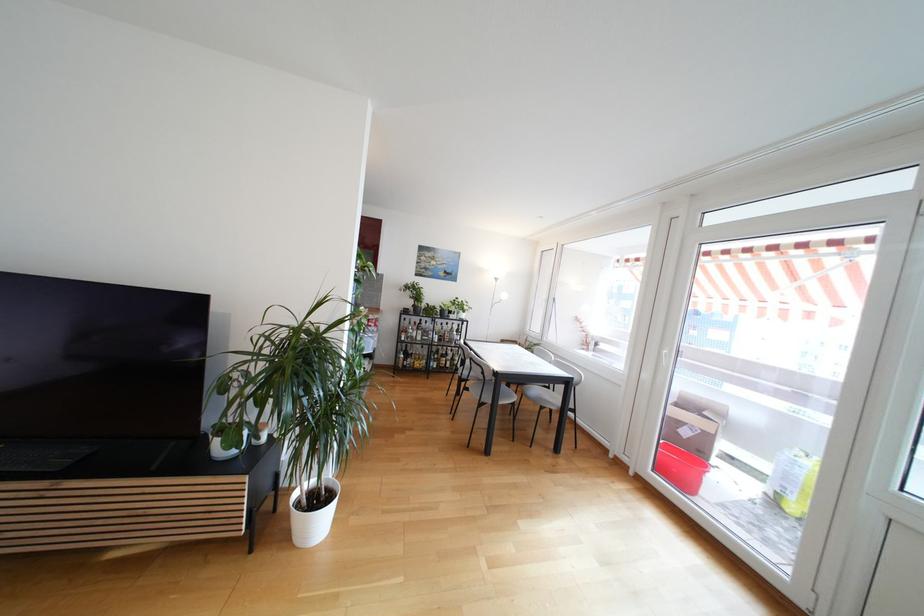
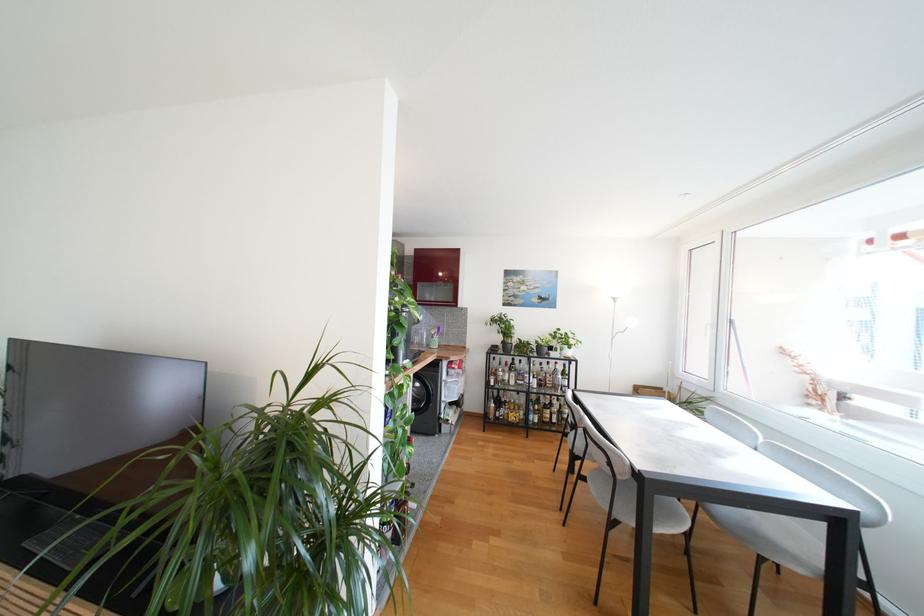
In the second image, find the point that corresponds to (x=447, y=368) in the first image.

(553, 423)